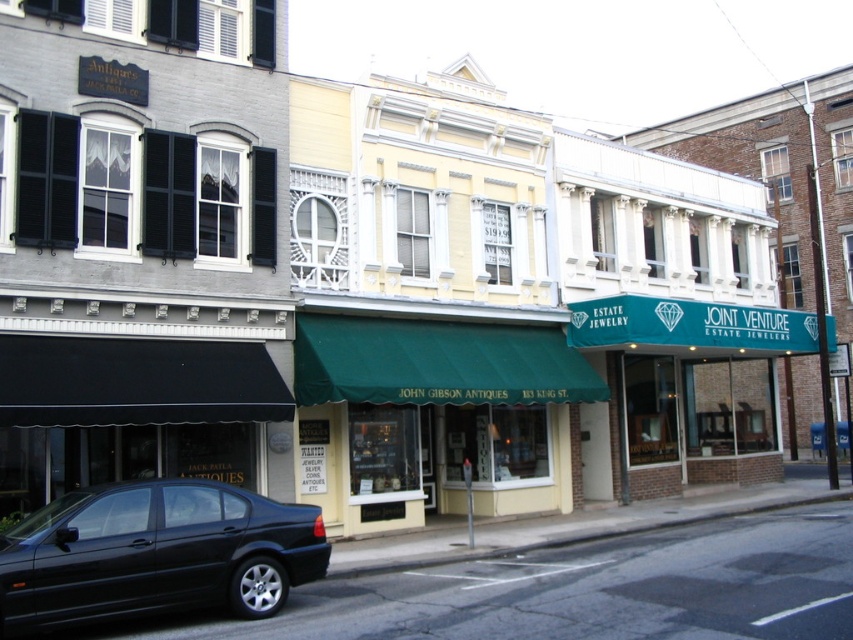
Is shiny black sedan at lower left shorter than teal fabric signboard at center?

No.

Which is in front, point (49, 516) or point (688, 330)?

Point (49, 516) is more forward.

The height and width of the screenshot is (640, 853). Identify the location of shiny black sedan at lower left. (155, 554).

Is shiny black sedan at lower left positioned behind green fabric awning at center?

No, shiny black sedan at lower left is closer to the viewer.

Which of these two, shiny black sedan at lower left or green fabric awning at center, stands shorter?

green fabric awning at center

Which is behind, point (57, 608) or point (419, 333)?

Point (419, 333)

Identify the location of shiny black sedan at lower left. (155, 554).

Is green fabric awning at center above teal fabric signboard at center?

No.

Can you confirm if green fabric awning at center is smaller than teal fabric signboard at center?

Yes, green fabric awning at center is smaller than teal fabric signboard at center.

Is point (447, 396) positioned before point (688, 310)?

Yes, point (447, 396) is in front of point (688, 310).

Find the location of `green fabric awning at center`. green fabric awning at center is located at coordinates (436, 362).